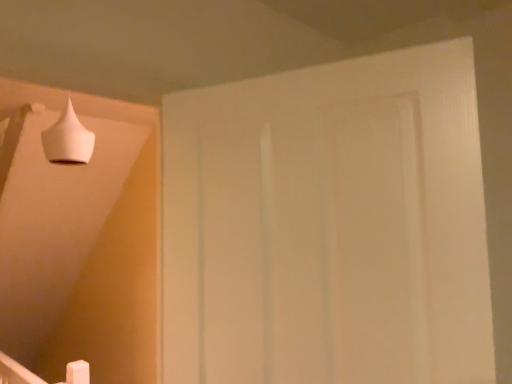
Question: Is white matte door at center situated inside white matte cone at upper left or outside?

Choices:
 (A) outside
 (B) inside

Answer: (A)

Question: From a real-world perspective, is white matte door at center positioned above or below white matte cone at upper left?

Choices:
 (A) below
 (B) above

Answer: (A)

Question: From the image's perspective, is white matte door at center positioned above or below white matte cone at upper left?

Choices:
 (A) above
 (B) below

Answer: (B)

Question: Is white matte cone at upper left to the left or to the right of white matte door at center in the image?

Choices:
 (A) left
 (B) right

Answer: (A)

Question: In terms of size, does white matte cone at upper left appear bigger or smaller than white matte door at center?

Choices:
 (A) big
 (B) small

Answer: (B)

Question: From the image's perspective, is white matte cone at upper left located above or below white matte door at center?

Choices:
 (A) below
 (B) above

Answer: (B)

Question: Considering the positions of point (68, 104) and point (266, 364), is point (68, 104) closer or farther from the camera than point (266, 364)?

Choices:
 (A) farther
 (B) closer

Answer: (A)